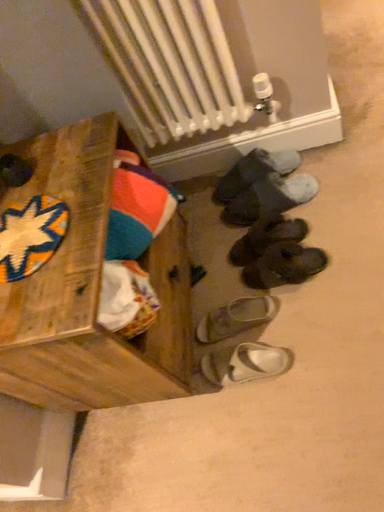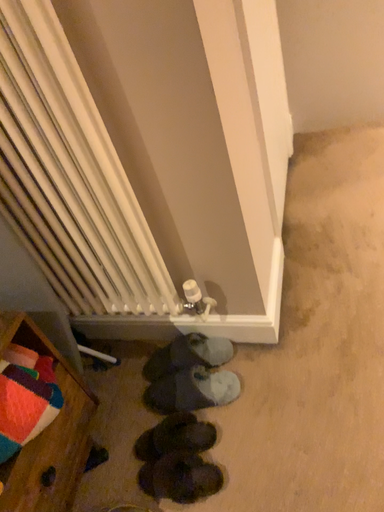
Question: How did the camera likely rotate when shooting the video?

Choices:
 (A) rotated upward
 (B) rotated downward

Answer: (A)